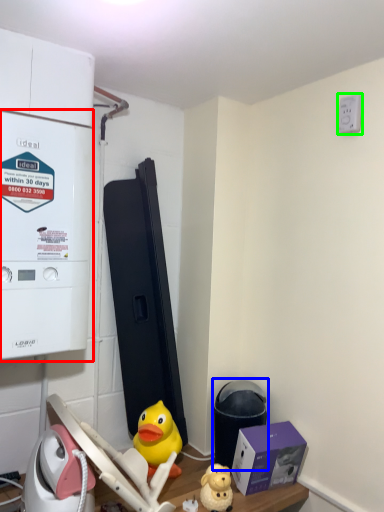
Question: Which is nearer to the appliance (highlighted by a red box)? water heater (highlighted by a blue box) or electric outlet (highlighted by a green box).

Choices:
 (A) water heater
 (B) electric outlet

Answer: (A)